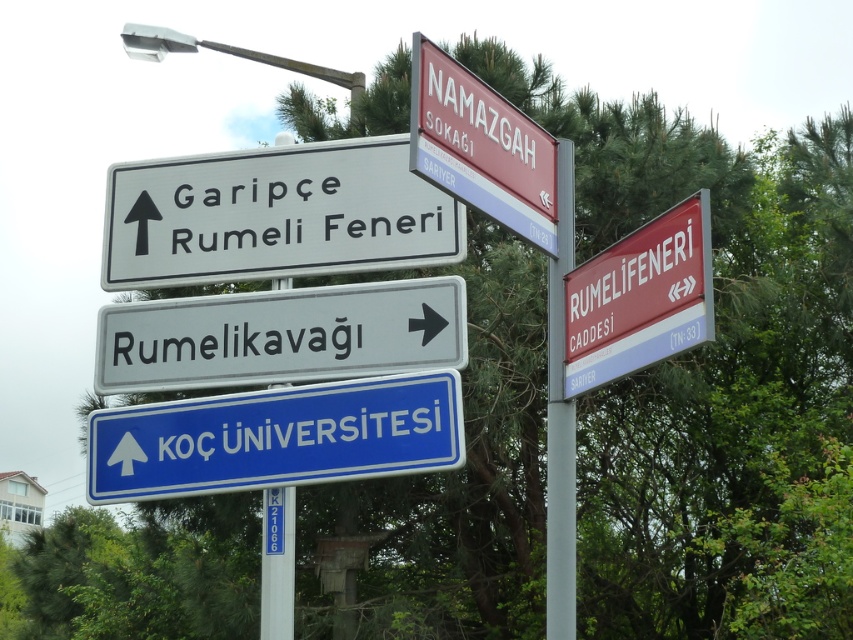
Question: Does white plastic sign at upper center come in front of blue metallic sign at center?

Choices:
 (A) no
 (B) yes

Answer: (A)

Question: From the image, what is the correct spatial relationship of white plastic sign at upper center in relation to red plastic sign at right?

Choices:
 (A) left
 (B) right

Answer: (A)

Question: Among these objects, which one is nearest to the camera?

Choices:
 (A) red plastic sign at right
 (B) red plastic sign at upper center
 (C) blue metallic sign at center

Answer: (A)

Question: Which of these objects is positioned farthest from the red plastic sign at upper center?

Choices:
 (A) red plastic sign at right
 (B) blue metallic sign at center
 (C) white plastic sign at upper center

Answer: (B)

Question: Can you confirm if white plastic sign at upper center is smaller than metallic signpost at right?

Choices:
 (A) yes
 (B) no

Answer: (B)

Question: Which object is positioned farthest from the metallic signpost at right?

Choices:
 (A) white plastic pole at center
 (B) blue metallic sign at center
 (C) red plastic sign at upper center
 (D) white plastic sign at center right

Answer: (D)